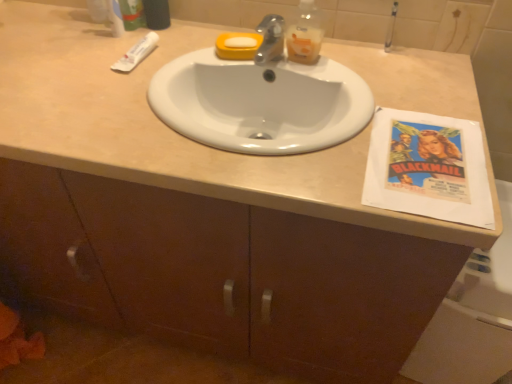
Image resolution: width=512 pixels, height=384 pixels. Identify the location of free spot to the right of translucent plastic bottle at upper center. (353, 64).